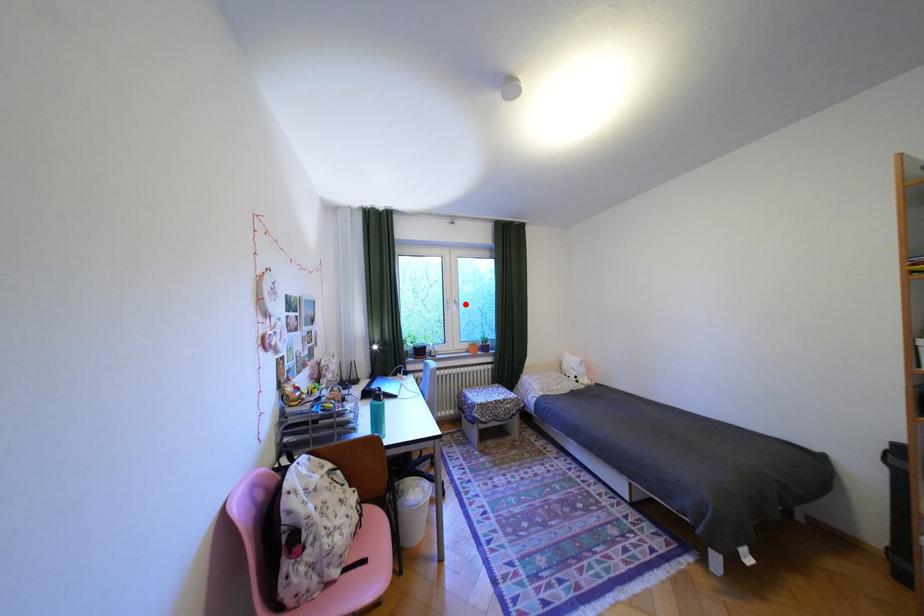
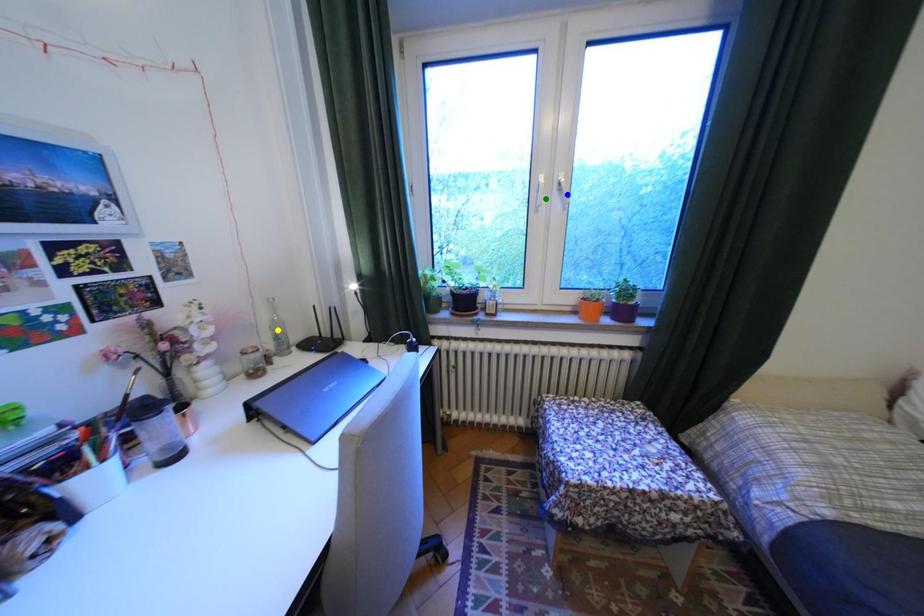
Question: I am providing you with two images of the same scene from different viewpoints. A red point is marked on the first image. You are given multiple points on the second image. Can you choose the point in image 2 that corresponds to the point in image 1?

Choices:
 (A) yellow point
 (B) blue point
 (C) green point

Answer: (B)